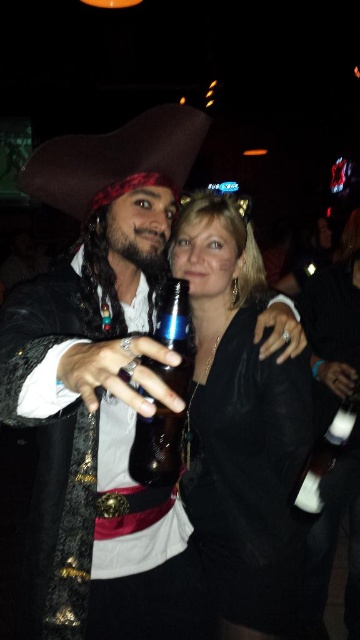
You are at a costume party and want to take a photo with the matte black pirate hat at upper left and the black velvet dress at center. If you want to ensure both items are visible in the frame, which one should you position closer to the camera?

The matte black pirate hat at upper left should be positioned closer to the camera because it is on the left side of the black velvet dress at center, so adjusting its position can help ensure both are in frame.

You are a photographer at the event and need to capture a closeup shot of the shiny metallic bottle at center without the matte black pirate hat at upper left blocking the view. Is the hat too large to avoid framing the bottle properly?

The matte black pirate hat at upper left is larger in size than the shiny metallic bottle at center. Since the hat is larger, it might block the view of the bottle if positioned between them, so you need to adjust the angle to ensure the hat doesn